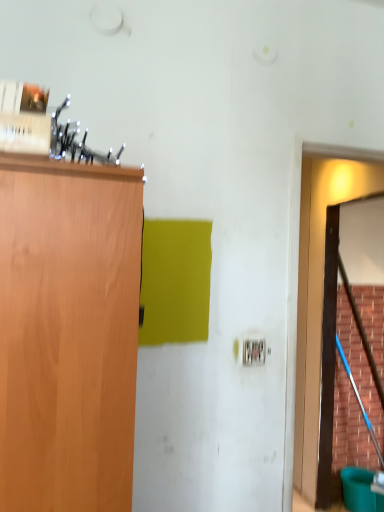
Question: From a real-world perspective, is brown wooden door at right on smooth wooden broom at right?

Choices:
 (A) no
 (B) yes

Answer: (B)

Question: Is brown wooden door at right not within smooth wooden broom at right?

Choices:
 (A) no
 (B) yes

Answer: (B)

Question: Is brown wooden door at right to the right of smooth wooden broom at right from the viewer's perspective?

Choices:
 (A) no
 (B) yes

Answer: (A)

Question: Is brown wooden door at right at the left side of smooth wooden broom at right?

Choices:
 (A) no
 (B) yes

Answer: (B)

Question: Is the depth of brown wooden door at right less than that of smooth wooden broom at right?

Choices:
 (A) no
 (B) yes

Answer: (B)

Question: Does brown wooden door at right have a greater height compared to smooth wooden broom at right?

Choices:
 (A) no
 (B) yes

Answer: (A)

Question: Can you confirm if smooth wooden broom at right is taller than brown wooden door at right?

Choices:
 (A) yes
 (B) no

Answer: (A)

Question: Is brown wooden door at right inside smooth wooden broom at right?

Choices:
 (A) no
 (B) yes

Answer: (A)

Question: Does smooth wooden broom at right appear on the right side of brown wooden door at right?

Choices:
 (A) no
 (B) yes

Answer: (B)

Question: From a real-world perspective, is smooth wooden broom at right positioned over brown wooden door at right based on gravity?

Choices:
 (A) no
 (B) yes

Answer: (A)

Question: Is smooth wooden broom at right oriented towards brown wooden door at right?

Choices:
 (A) no
 (B) yes

Answer: (A)

Question: Can you confirm if smooth wooden broom at right is thinner than brown wooden door at right?

Choices:
 (A) no
 (B) yes

Answer: (B)

Question: Does point tap(334, 451) appear closer or farther from the camera than point tap(319, 286)?

Choices:
 (A) farther
 (B) closer

Answer: (A)